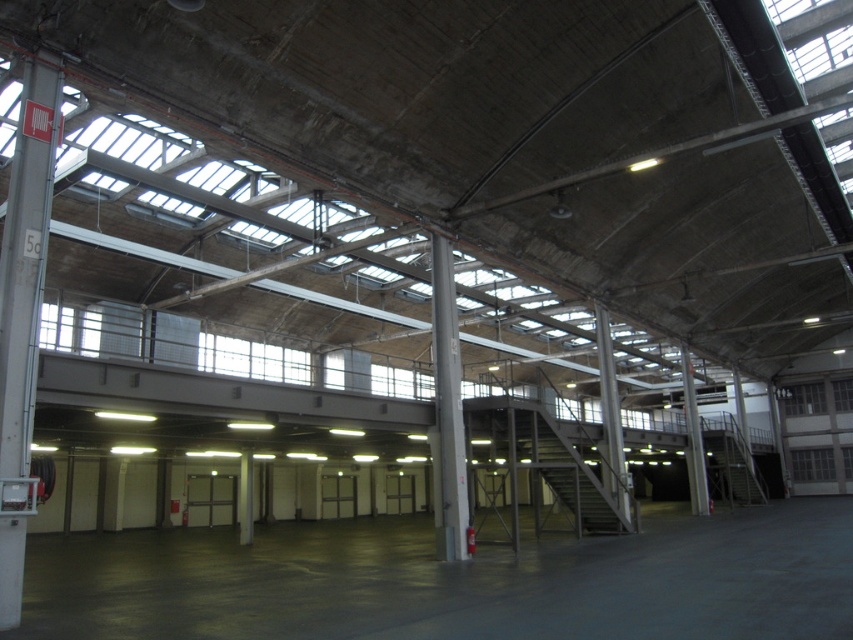
Question: From the image, what is the correct spatial relationship of gray metallic column at center in relation to metallic gray pillar at center-right?

Choices:
 (A) below
 (B) above

Answer: (B)

Question: Which point appears closest to the camera in this image?

Choices:
 (A) (461, 404)
 (B) (242, 456)

Answer: (A)

Question: Does white glossy pillar at left appear over gray concrete pillar at center?

Choices:
 (A) yes
 (B) no

Answer: (A)

Question: Is the position of metallic gray pillar at center-right more distant than that of metallic gray pillar at center?

Choices:
 (A) no
 (B) yes

Answer: (A)

Question: Which object appears farthest from the camera in this image?

Choices:
 (A) gray metallic column at center
 (B) metallic gray pillar at center
 (C) white glossy pillar at left
 (D) gray concrete pillar at center

Answer: (B)

Question: Which of the following is the closest to the observer?

Choices:
 (A) (25, 262)
 (B) (598, 356)
 (C) (700, 500)
 (D) (440, 392)

Answer: (A)